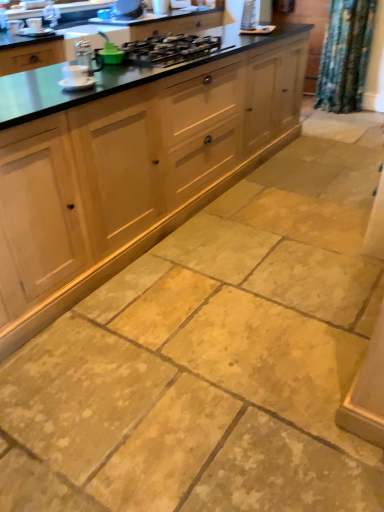
Identify the location of natural wood cabinets at center. This screenshot has height=512, width=384. (134, 170).

This screenshot has width=384, height=512. Find the location of `metallic black gas stove at center`. metallic black gas stove at center is located at coordinates (169, 49).

This screenshot has width=384, height=512. What do you see at coordinates (161, 7) in the screenshot?
I see `white glossy mug at upper center, which is the fifth appliance in front-to-back order` at bounding box center [161, 7].

How much space does white glossy mug at upper center, which is the fifth appliance in front-to-back order, occupy vertically?

17.85 centimeters.

You are a GUI agent. You are given a task and a screenshot of the screen. Output one action in this format:
    pyautogui.click(x=<x>, y=<y>)
    Task: Click on the matte white cup at upper left, acting as the 3th appliance starting from the top
    
    Given the screenshot: What is the action you would take?
    [x=34, y=24]

From a real-world perspective, which appliance is the 4th one underneath the white glossy mug at upper center, which is the fifth appliance in front-to-back order? Please provide its 2D coordinates.

[(75, 76)]

Looking at the image, does white glossy mug at upper center, arranged as the 1th appliance when viewed from the back, seem bigger or smaller compared to white ceramic cup at upper left, the 1th appliance viewed from the front?

white glossy mug at upper center, arranged as the 1th appliance when viewed from the back, is bigger than white ceramic cup at upper left, the 1th appliance viewed from the front.

Does white glossy mug at upper center, acting as the fifth appliance starting from the bottom, come behind white ceramic cup at upper left, the 1th appliance viewed from the front?

Yes, white glossy mug at upper center, acting as the fifth appliance starting from the bottom, is further from the viewer.

Do you think white glossy mug at upper center, arranged as the 1th appliance when viewed from the back, is within white ceramic cup at upper left, which appears as the 1th appliance when ordered from the bottom, or outside of it?

white glossy mug at upper center, arranged as the 1th appliance when viewed from the back, lies outside white ceramic cup at upper left, which appears as the 1th appliance when ordered from the bottom.

Between matte white cup at upper left, which is the 1th appliance in left-to-right order, and white glossy mug at upper center, which appears as the first appliance when viewed from the top, which one is positioned in front?

matte white cup at upper left, which is the 1th appliance in left-to-right order, is in front.

Looking at the image, does matte white cup at upper left, the 3th appliance in the back-to-front sequence, seem bigger or smaller compared to white glossy mug at upper center, which is the first appliance in right-to-left order?

Considering their sizes, matte white cup at upper left, the 3th appliance in the back-to-front sequence, takes up less space than white glossy mug at upper center, which is the first appliance in right-to-left order.

Can white glossy mug at upper center, which is the fifth appliance in front-to-back order, be found inside matte white cup at upper left, the fifth appliance positioned from the right?

No, white glossy mug at upper center, which is the fifth appliance in front-to-back order, is not inside matte white cup at upper left, the fifth appliance positioned from the right.

From their relative heights in the image, would you say white glossy mug at upper center, arranged as the 1th appliance when viewed from the back, is taller or shorter than metallic silver kettle at upper center, marked as the second appliance in a back-to-front arrangement?

white glossy mug at upper center, arranged as the 1th appliance when viewed from the back, is taller than metallic silver kettle at upper center, marked as the second appliance in a back-to-front arrangement.

Based on the photo, can you confirm if white glossy mug at upper center, the 5th appliance from the left, is bigger than metallic silver kettle at upper center, which is the 2th appliance from top to bottom?

Incorrect, white glossy mug at upper center, the 5th appliance from the left, is not larger than metallic silver kettle at upper center, which is the 2th appliance from top to bottom.

Locate an element on the screen. The width and height of the screenshot is (384, 512). the 2nd appliance above the metallic silver kettle at upper center, the 4th appliance when ordered from front to back (from a real-world perspective) is located at coordinates (161, 7).

Is metallic silver kettle at upper center, the 4th appliance when ordered from front to back, at the back of white glossy mug at upper center, which is the fifth appliance in front-to-back order?

That's not correct — white glossy mug at upper center, which is the fifth appliance in front-to-back order, is not looking away from metallic silver kettle at upper center, the 4th appliance when ordered from front to back.

Considering the sizes of green plastic brush at upper center, marked as the 4th appliance in a back-to-front arrangement, and white glossy mug at upper center, acting as the fifth appliance starting from the bottom, in the image, is green plastic brush at upper center, marked as the 4th appliance in a back-to-front arrangement, bigger or smaller than white glossy mug at upper center, acting as the fifth appliance starting from the bottom,?

Considering their sizes, green plastic brush at upper center, marked as the 4th appliance in a back-to-front arrangement, takes up less space than white glossy mug at upper center, acting as the fifth appliance starting from the bottom.

Could you tell me if green plastic brush at upper center, acting as the 2th appliance starting from the bottom, is facing white glossy mug at upper center, the 5th appliance from the left?

No, green plastic brush at upper center, acting as the 2th appliance starting from the bottom, does not turn towards white glossy mug at upper center, the 5th appliance from the left.

Is green plastic brush at upper center, the 4th appliance when ordered from left to right, wider than white glossy mug at upper center, which is the first appliance in right-to-left order?

No.

Between green plastic brush at upper center, the 4th appliance when ordered from left to right, and white glossy mug at upper center, which is the fifth appliance in front-to-back order, which one has less height?

green plastic brush at upper center, the 4th appliance when ordered from left to right.

Considering the relative positions of metallic silver kettle at upper center, the fourth appliance in the right-to-left sequence, and matte white cup at upper left, which is the 1th appliance in left-to-right order, in the image provided, is metallic silver kettle at upper center, the fourth appliance in the right-to-left sequence, to the left or to the right of matte white cup at upper left, which is the 1th appliance in left-to-right order,?

metallic silver kettle at upper center, the fourth appliance in the right-to-left sequence, is to the right of matte white cup at upper left, which is the 1th appliance in left-to-right order.

Find the location of a particular element. appliance that is the 1st object located below the metallic silver kettle at upper center, the fourth appliance in the right-to-left sequence (from the image's perspective) is located at coordinates (x=34, y=24).

How many degrees apart are the facing directions of metallic silver kettle at upper center, the 4th appliance when ordered from front to back, and matte white cup at upper left, which is the 1th appliance in left-to-right order?

The facing directions of metallic silver kettle at upper center, the 4th appliance when ordered from front to back, and matte white cup at upper left, which is the 1th appliance in left-to-right order, are 0.244 degrees apart.

Could matte white cup at upper left, acting as the 3th appliance starting from the top, be considered to be inside metallic silver kettle at upper center, the second appliance viewed from the left?

Definitely not — matte white cup at upper left, acting as the 3th appliance starting from the top, is not inside metallic silver kettle at upper center, the second appliance viewed from the left.

Does green plastic brush at upper center, acting as the 2th appliance starting from the bottom, turn towards natural wood cabinets at center?

No, green plastic brush at upper center, acting as the 2th appliance starting from the bottom, does not turn towards natural wood cabinets at center.

Is green plastic brush at upper center, the 2th appliance when ordered from front to back, positioned far away from natural wood cabinets at center?

Actually, green plastic brush at upper center, the 2th appliance when ordered from front to back, and natural wood cabinets at center are a little close together.

Between green plastic brush at upper center, which is the 2th appliance in right-to-left order, and natural wood cabinets at center, which one appears on the right side from the viewer's perspective?

Positioned to the right is natural wood cabinets at center.

Looking at their sizes, would you say green plastic brush at upper center, the 2th appliance when ordered from front to back, is wider or thinner than natural wood cabinets at center?

Clearly, green plastic brush at upper center, the 2th appliance when ordered from front to back, has less width compared to natural wood cabinets at center.

Is white ceramic cup at upper left, which appears as the 1th appliance when ordered from the bottom, next to green plastic brush at upper center, the 2th appliance when ordered from front to back, and touching it?

No, white ceramic cup at upper left, which appears as the 1th appliance when ordered from the bottom, is not with green plastic brush at upper center, the 2th appliance when ordered from front to back.

Is white ceramic cup at upper left, which is the fifth appliance from back to front, to the right of green plastic brush at upper center, acting as the 2th appliance starting from the bottom, from the viewer's perspective?

In fact, white ceramic cup at upper left, which is the fifth appliance from back to front, is to the left of green plastic brush at upper center, acting as the 2th appliance starting from the bottom.

Is point (67, 73) behind point (102, 34)?

No, it is in front of (102, 34).

How much distance is there between white ceramic cup at upper left, the 1th appliance viewed from the front, and green plastic brush at upper center, which ranks as the fourth appliance in top-to-bottom order?

white ceramic cup at upper left, the 1th appliance viewed from the front, and green plastic brush at upper center, which ranks as the fourth appliance in top-to-bottom order, are 38.24 centimeters apart.

You are a GUI agent. You are given a task and a screenshot of the screen. Output one action in this format:
    pyautogui.click(x=<x>, y=<y>)
    Task: Click on the appliance that is the 4th object located behind the white ceramic cup at upper left, which is the fifth appliance from back to front
    Image resolution: width=384 pixels, height=512 pixels.
    Given the screenshot: What is the action you would take?
    point(161,7)

The image size is (384, 512). Identify the location of appliance that is the 2nd one when counting forward from the white glossy mug at upper center, which is the fifth appliance in front-to-back order. (34, 24).

Based on their spatial positions, is metallic silver kettle at upper center, which is the fourth appliance from bottom to top, or matte white cup at upper left, the 3th appliance ordered from the bottom, further from green plastic brush at upper center, marked as the 4th appliance in a back-to-front arrangement?

metallic silver kettle at upper center, which is the fourth appliance from bottom to top, lies further to green plastic brush at upper center, marked as the 4th appliance in a back-to-front arrangement, than the other object.

Considering their positions, is matte white cup at upper left, the 3th appliance ordered from the bottom, positioned closer to natural wood cabinets at center than metallic black gas stove at center?

metallic black gas stove at center.

In the scene shown: Considering their positions, is metallic black gas stove at center positioned closer to white ceramic cup at upper left, arranged as the 3th appliance when viewed from the right, than metallic silver kettle at upper center, marked as the second appliance in a back-to-front arrangement?

metallic black gas stove at center is closer to white ceramic cup at upper left, arranged as the 3th appliance when viewed from the right.

Which object lies further to the anchor point natural wood cabinets at center, green plastic brush at upper center, the 4th appliance when ordered from left to right, or metallic black gas stove at center?

green plastic brush at upper center, the 4th appliance when ordered from left to right.

Which object lies further to the anchor point green plastic brush at upper center, the 4th appliance when ordered from left to right, matte white cup at upper left, acting as the 3th appliance starting from the top, or metallic silver kettle at upper center, the second appliance viewed from the left?

Among the two, metallic silver kettle at upper center, the second appliance viewed from the left, is located further to green plastic brush at upper center, the 4th appliance when ordered from left to right.

Estimate the real-world distances between objects in this image. Which object is closer to white ceramic cup at upper left, which is counted as the 3th appliance, starting from the left, white glossy mug at upper center, the 5th appliance from the left, or metallic silver kettle at upper center, the 4th appliance when ordered from front to back?

metallic silver kettle at upper center, the 4th appliance when ordered from front to back, lies closer to white ceramic cup at upper left, which is counted as the 3th appliance, starting from the left, than the other object.

Based on their spatial positions, is white glossy mug at upper center, acting as the fifth appliance starting from the bottom, or metallic black gas stove at center further from natural wood cabinets at center?

white glossy mug at upper center, acting as the fifth appliance starting from the bottom.

From the image, which object appears to be farther from natural wood cabinets at center, metallic black gas stove at center or white ceramic cup at upper left, which appears as the 1th appliance when ordered from the bottom?

white ceramic cup at upper left, which appears as the 1th appliance when ordered from the bottom.

Identify the location of gas stove between natural wood cabinets at center and metallic silver kettle at upper center, which is the 2th appliance from top to bottom, in the front-back direction. The height and width of the screenshot is (512, 384). (169, 49).

You are a GUI agent. You are given a task and a screenshot of the screen. Output one action in this format:
    pyautogui.click(x=<x>, y=<y>)
    Task: Click on the appliance positioned between green plastic brush at upper center, marked as the 4th appliance in a back-to-front arrangement, and metallic silver kettle at upper center, which is the fourth appliance from bottom to top, from near to far
    
    Given the screenshot: What is the action you would take?
    tap(34, 24)

Where is `appliance positioned between metallic black gas stove at center and matte white cup at upper left, acting as the 3th appliance starting from the top, from near to far`? This screenshot has width=384, height=512. appliance positioned between metallic black gas stove at center and matte white cup at upper left, acting as the 3th appliance starting from the top, from near to far is located at coordinates (110, 52).

Find the location of a particular element. appliance between natural wood cabinets at center and green plastic brush at upper center, the 4th appliance when ordered from left to right, in the front-back direction is located at coordinates (75, 76).